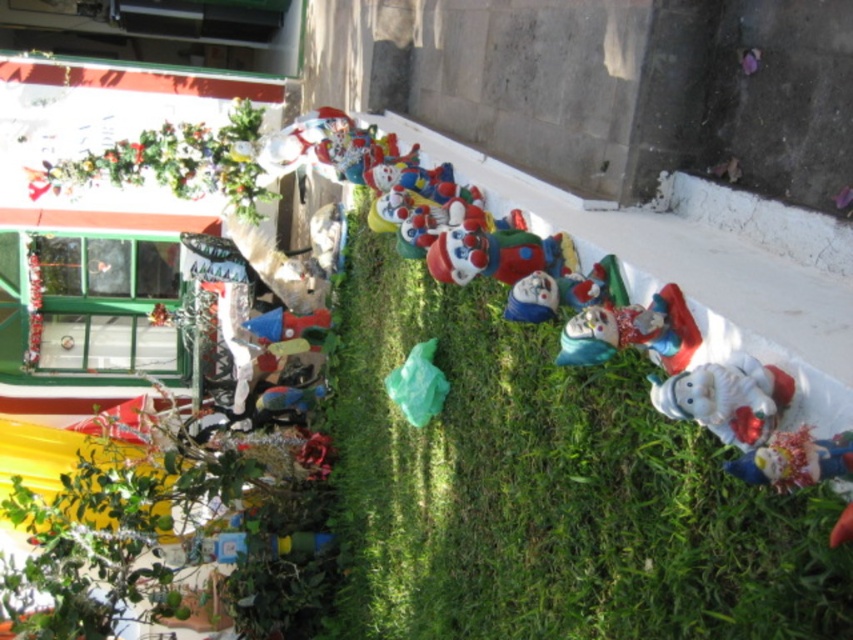
Based on the photo, you are standing in front of the clowns and want to place a small toy on the ground between the green grass at center and the matte plastic clown at center. Which object should you place it closer to if you want the toy to be closer to the viewer?

You should place the toy closer to the green grass at center because it is closer to the viewer than the matte plastic clown at center.

You are standing at the center of the image and want to place a new red clown figurine exactly 0.3 units to the left of the white glossy santa at lower right. What is the 2D coordinate of the position where you should place the new red clown figurine?

The white glossy santa at lower right is located at point (726, 397). Subtracting 0.3 from the x coordinate gives 0.623 minus 0.3 equals 0.323. The new position would be at (726, 205).